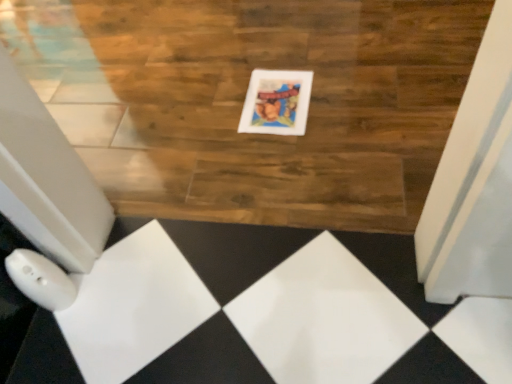
The height and width of the screenshot is (384, 512). I want to click on free point to the right of white glossy picture frame at center, so click(344, 89).